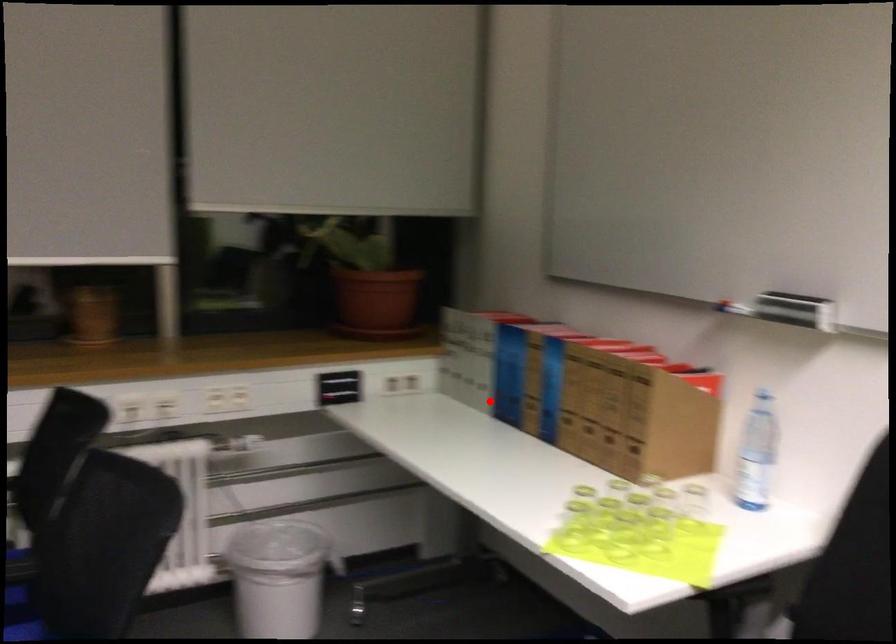
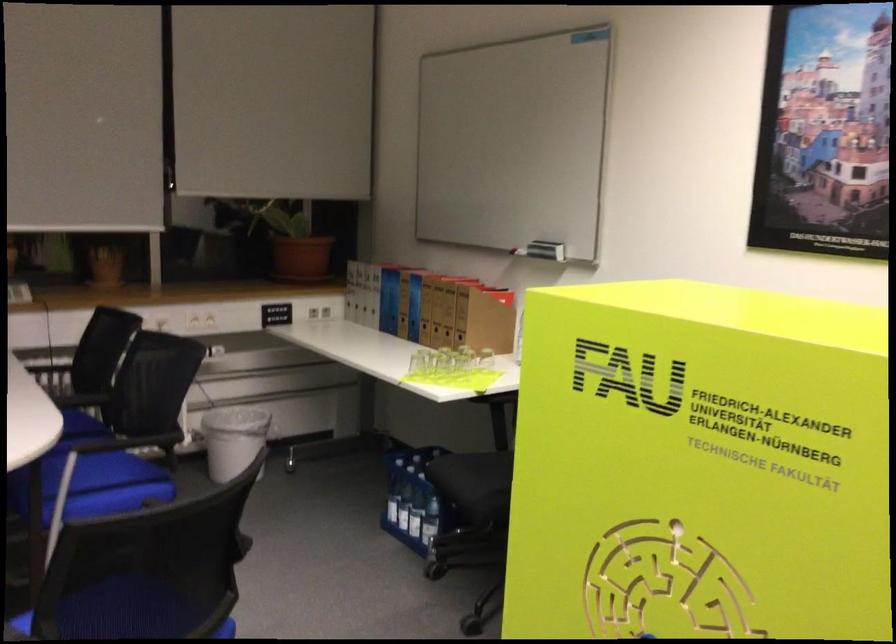
Locate, in the second image, the point that corresponds to the highlighted location in the first image.

(382, 321)